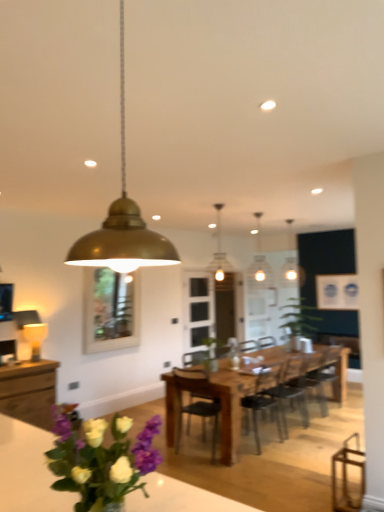
Question: Considering the positions of green matte plant at center and wooden chair at center, placed as the first chair when sorted from left to right, in the image, is green matte plant at center bigger or smaller than wooden chair at center, placed as the first chair when sorted from left to right,?

Choices:
 (A) big
 (B) small

Answer: (A)

Question: From a real-world perspective, relative to wooden chair at center, placed as the first chair when sorted from left to right, is green matte plant at center vertically above or below?

Choices:
 (A) above
 (B) below

Answer: (A)

Question: Which object is positioned closest to the black leather chair at center, marked as the first chair in a right-to-left arrangement?

Choices:
 (A) clear glass window at center
 (B) purple matte flower at lower left
 (C) wooden chair at center, which ranks as the 4th chair in right-to-left order
 (D) wooden dining table at center
 (E) clear glass door at center

Answer: (C)

Question: Based on their relative distances, which object is nearer to the clear glass window at center?

Choices:
 (A) matte gold lampshade at left, positioned as the 1th lamp in left-to-right order
 (B) matte gold pendant light at center, which is the second lamp in front-to-back order
 (C) black matte chair at center, which is counted as the 3th chair, starting from the left
 (D) wooden dining table at center
 (E) wooden chair at center, positioned as the 5th chair in right-to-left order

Answer: (A)